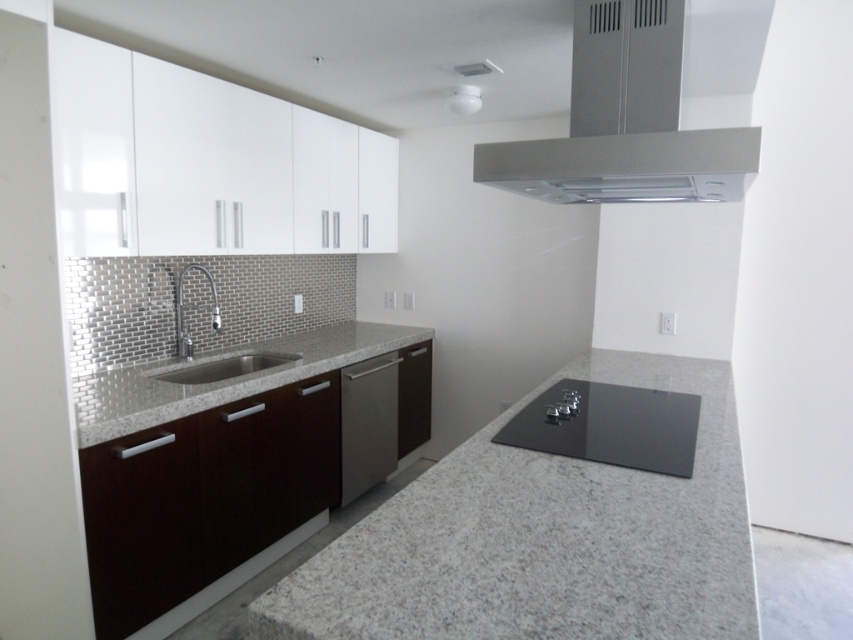
Is satin stainless steel dishwasher at center further to camera compared to stainless steel sink at center?

That is True.

Does satin stainless steel dishwasher at center have a greater height compared to stainless steel sink at center?

Indeed, satin stainless steel dishwasher at center has a greater height compared to stainless steel sink at center.

Measure the distance between satin stainless steel dishwasher at center and camera.

A distance of 10.31 feet exists between satin stainless steel dishwasher at center and camera.

I want to click on satin stainless steel dishwasher at center, so click(368, 422).

Between satin silver metallic exhaust hood at upper center and gray granite countertop at left, which one appears on the left side from the viewer's perspective?

From the viewer's perspective, gray granite countertop at left appears more on the left side.

In the scene shown: Who is more distant from viewer, (622, 83) or (109, 424)?

Point (109, 424)

Identify the location of satin silver metallic exhaust hood at upper center. This screenshot has height=640, width=853. pos(625,122).

Where is `satin silver metallic exhaust hood at upper center`? satin silver metallic exhaust hood at upper center is located at coordinates coord(625,122).

Is stainless steel sink at center to the right of chrome metallic faucet at left from the viewer's perspective?

Indeed, stainless steel sink at center is positioned on the right side of chrome metallic faucet at left.

Who is taller, stainless steel sink at center or chrome metallic faucet at left?

Standing taller between the two is stainless steel sink at center.

Locate an element on the screen. stainless steel sink at center is located at coordinates (225, 368).

Where is `stainless steel sink at center`? This screenshot has height=640, width=853. stainless steel sink at center is located at coordinates (225, 368).